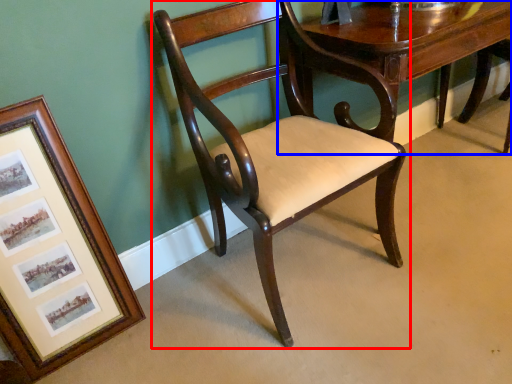
Question: Which object appears farthest to the camera in this image, chair (highlighted by a red box) or table (highlighted by a blue box)?

Choices:
 (A) chair
 (B) table

Answer: (B)